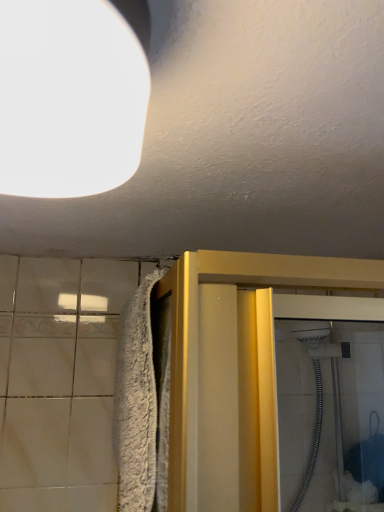
Question: Should I look upward or downward to see white matte light fixture at upper left?

Choices:
 (A) down
 (B) up

Answer: (B)

Question: Is white fluffy bath towel at left wider than white matte light fixture at upper left?

Choices:
 (A) yes
 (B) no

Answer: (B)

Question: Is white fluffy bath towel at left surrounding white matte light fixture at upper left?

Choices:
 (A) yes
 (B) no

Answer: (B)

Question: Does white fluffy bath towel at left have a larger size compared to white matte light fixture at upper left?

Choices:
 (A) yes
 (B) no

Answer: (A)

Question: Is white fluffy bath towel at left at the left side of white matte light fixture at upper left?

Choices:
 (A) yes
 (B) no

Answer: (B)

Question: From the image's perspective, is white fluffy bath towel at left over white matte light fixture at upper left?

Choices:
 (A) no
 (B) yes

Answer: (A)

Question: Considering the relative positions of white fluffy bath towel at left and white matte light fixture at upper left in the image provided, is white fluffy bath towel at left to the right of white matte light fixture at upper left from the viewer's perspective?

Choices:
 (A) yes
 (B) no

Answer: (A)

Question: Can you see white matte light fixture at upper left touching white fluffy bath towel at left?

Choices:
 (A) yes
 (B) no

Answer: (B)

Question: Does white matte light fixture at upper left come behind white fluffy bath towel at left?

Choices:
 (A) no
 (B) yes

Answer: (A)

Question: Can you confirm if white matte light fixture at upper left is shorter than white fluffy bath towel at left?

Choices:
 (A) yes
 (B) no

Answer: (A)

Question: Can you confirm if white matte light fixture at upper left is wider than white fluffy bath towel at left?

Choices:
 (A) yes
 (B) no

Answer: (A)

Question: Is white matte light fixture at upper left smaller than white fluffy bath towel at left?

Choices:
 (A) yes
 (B) no

Answer: (A)

Question: Would you say white matte light fixture at upper left is a long distance from white fluffy bath towel at left?

Choices:
 (A) no
 (B) yes

Answer: (A)

Question: Considering the positions of white fluffy bath towel at left and white matte light fixture at upper left in the image, is white fluffy bath towel at left taller or shorter than white matte light fixture at upper left?

Choices:
 (A) tall
 (B) short

Answer: (A)